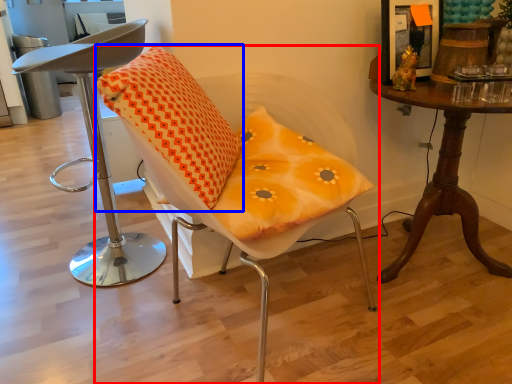
Question: Which of the following is the closest to the observer, chair (highlighted by a red box) or pillow (highlighted by a blue box)?

Choices:
 (A) chair
 (B) pillow

Answer: (A)